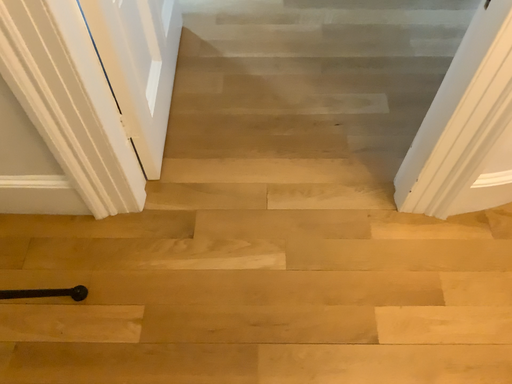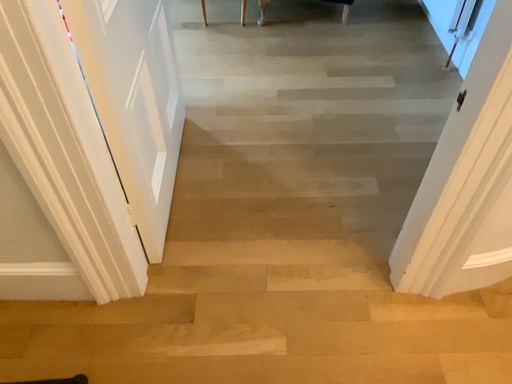
Question: Which way did the camera rotate in the video?

Choices:
 (A) rotated upward
 (B) rotated downward

Answer: (A)